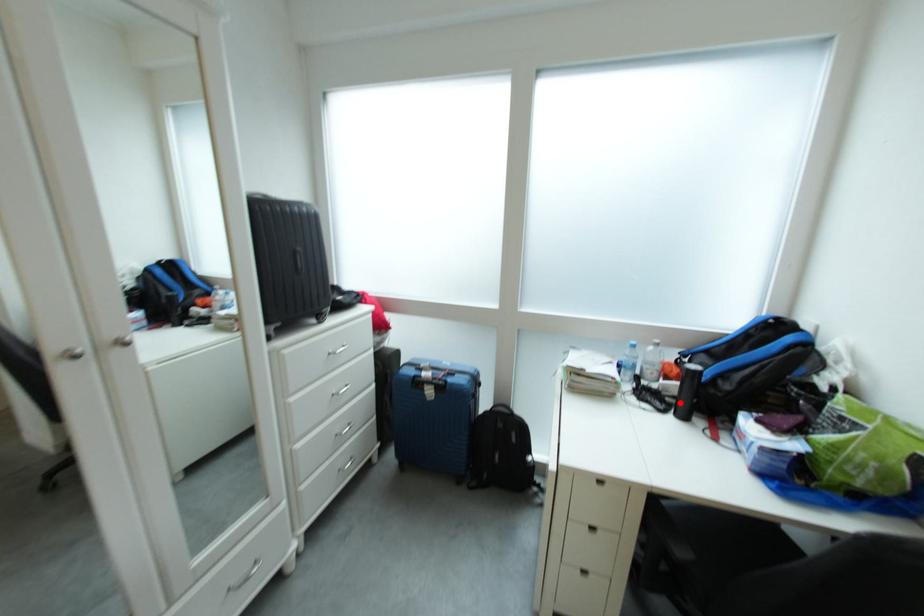
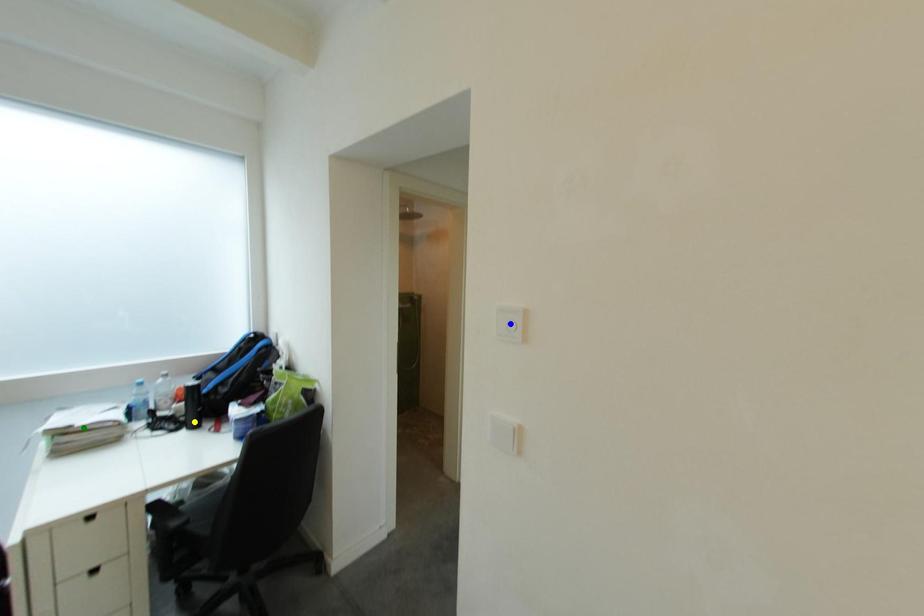
Question: I am providing you with two images of the same scene from different viewpoints. A red point is marked on the first image. You are given multiple points on the second image. Which point in image 2 is actually the same real-world point as the red point in image 1?

Choices:
 (A) yellow point
 (B) blue point
 (C) green point

Answer: (A)